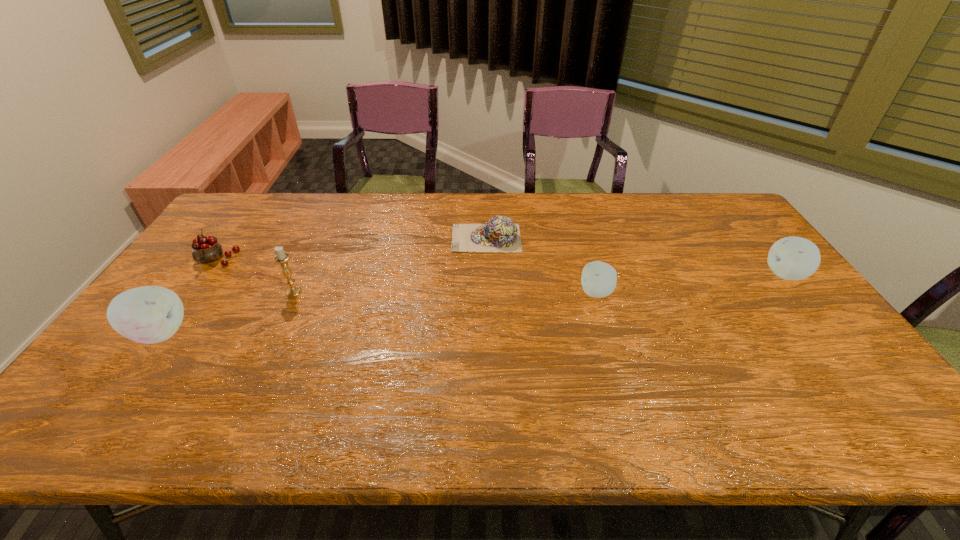
Find the location of a particular element. blank region between the cherry and the leftmost apple is located at coordinates (188, 296).

At what (x,y) coordinates should I click in order to perform the action: click on free point between the rightmost object and the second apple from left to right. Please return your answer as a coordinate pair (x, y). Image resolution: width=960 pixels, height=540 pixels. Looking at the image, I should click on (691, 284).

Identify the location of vacant area that lies between the leftmost apple and the candle holder. The image size is (960, 540). (227, 313).

Identify the location of free area in between the second apple from left to right and the cherry. (406, 276).

This screenshot has height=540, width=960. I want to click on vacant region between the nearest object and the rightmost object, so coord(472,304).

I want to click on vacant area that lies between the shortest object and the shortest apple, so click(x=541, y=266).

Identify which object is the fifth nearest to the second tallest apple. Please provide its 2D coordinates. Your answer should be formatted as a tuple, i.e. [(x, y)], where the tuple contains the x and y coordinates of a point satisfying the conditions above.

[(207, 249)]

Identify which object is the fourth nearest to the fifth object from left to right. Please provide its 2D coordinates. Your answer should be formatted as a tuple, i.e. [(x, y)], where the tuple contains the x and y coordinates of a point satisfying the conditions above.

[(151, 314)]

You are a GUI agent. You are given a task and a screenshot of the screen. Output one action in this format:
    pyautogui.click(x=<x>, y=<y>)
    Task: Click on the apple that is the third closest to the candle holder
    This screenshot has width=960, height=540.
    Given the screenshot: What is the action you would take?
    pyautogui.click(x=791, y=258)

Point out which apple is positioned as the nearest to the leftmost apple. Please provide its 2D coordinates. Your answer should be formatted as a tuple, i.e. [(x, y)], where the tuple contains the x and y coordinates of a point satisfying the conditions above.

[(599, 279)]